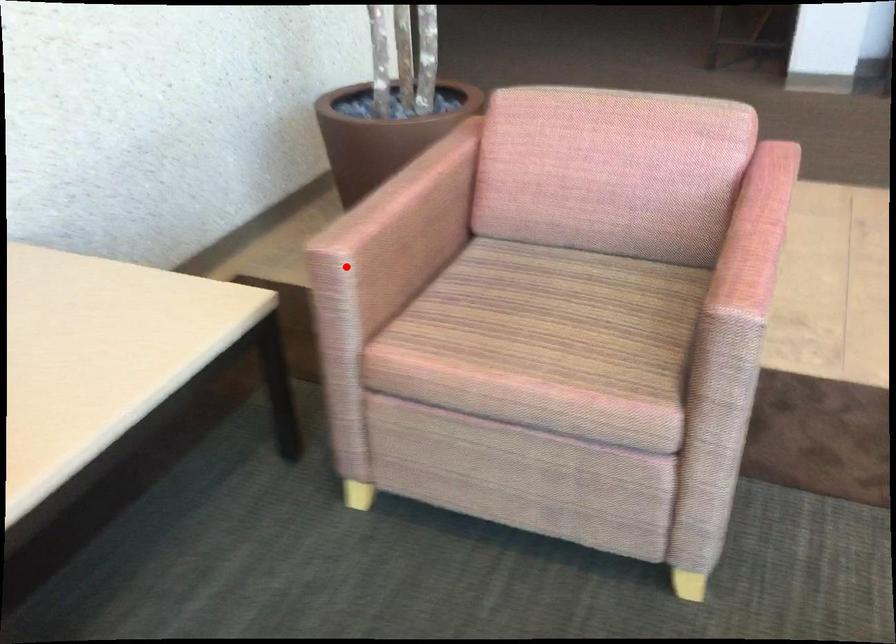
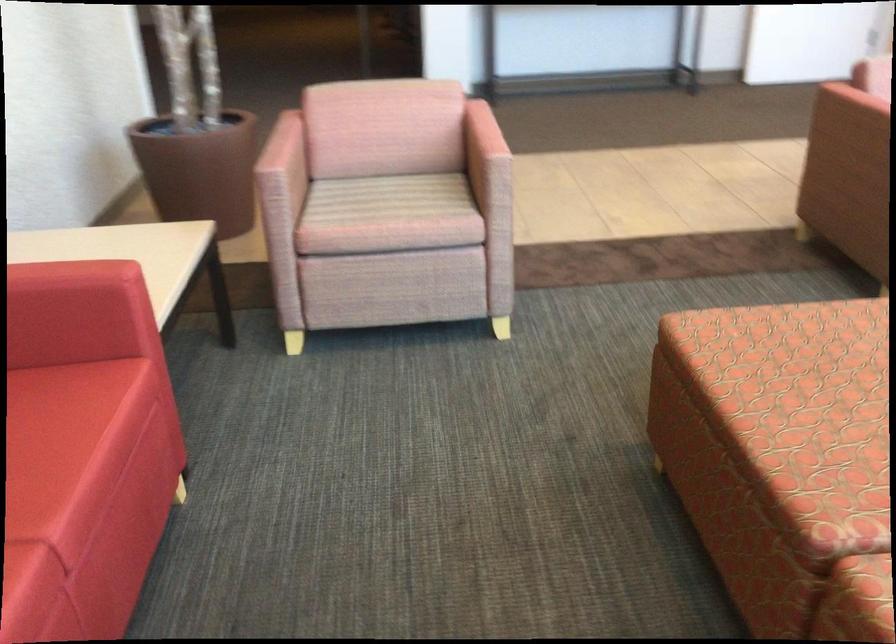
Question: I am providing you with two images of the same scene from different viewpoints. Given a red point in image1, look at the same physical point in image2. Is it:

Choices:
 (A) Closer to the viewpoint
 (B) Farther from the viewpoint

Answer: (B)